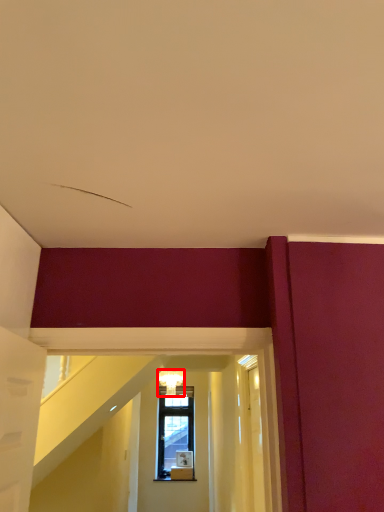
Question: Considering the relative positions of light fixture (annotated by the red box) and glass door in the image provided, where is light fixture (annotated by the red box) located with respect to the staircase?

Choices:
 (A) left
 (B) right

Answer: (A)